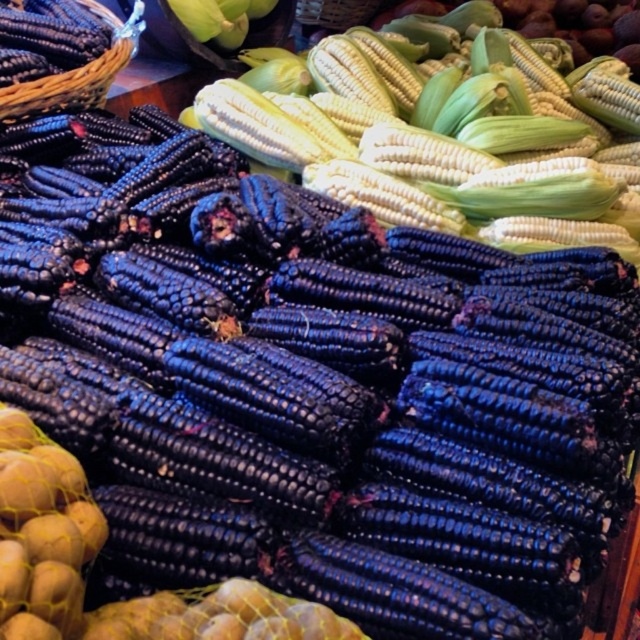
Who is more forward, [502,154] or [29,104]?

Point [29,104] is more forward.

The height and width of the screenshot is (640, 640). Identify the location of blue matte corn at center. (451, 134).

Where is `blue matte corn at center`? The width and height of the screenshot is (640, 640). blue matte corn at center is located at coordinates (451, 134).